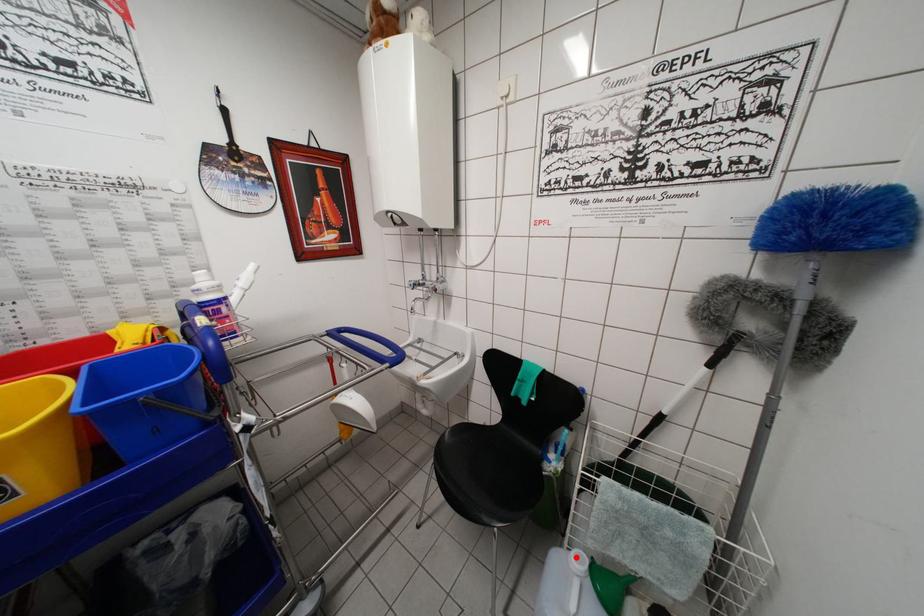
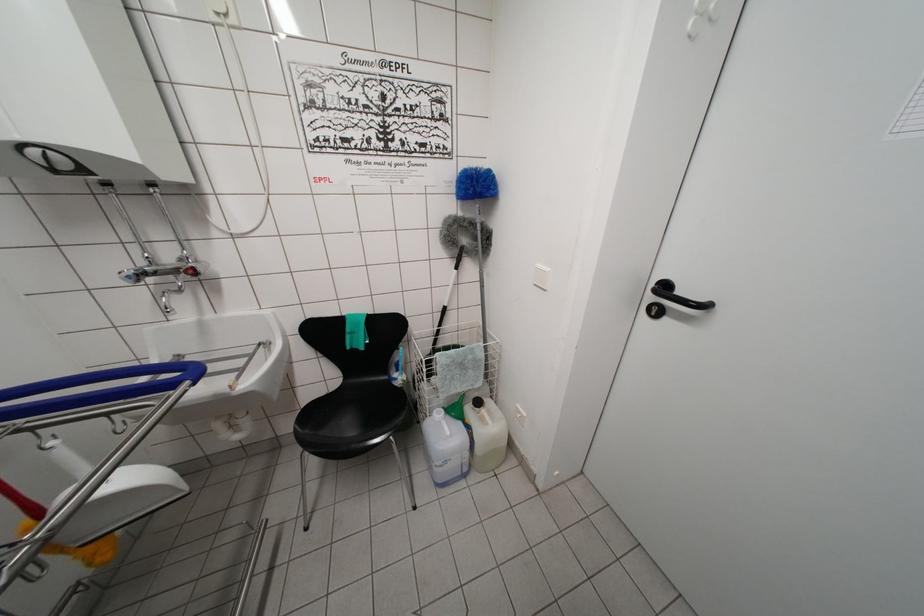
Question: I am providing you with two images of the same scene from different viewpoints. Given a red point in image1, look at the same physical point in image2. Is it:

Choices:
 (A) Closer to the viewpoint
 (B) Farther from the viewpoint

Answer: (B)